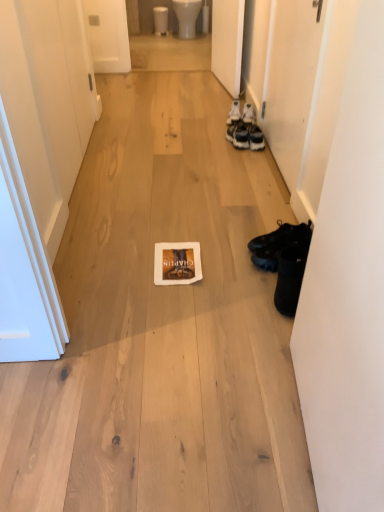
Locate an element on the screen. The width and height of the screenshot is (384, 512). free space underneath black leather shoes at lower right, which is counted as the third footwear, starting from the top (from a real-world perspective) is located at coordinates (274, 293).